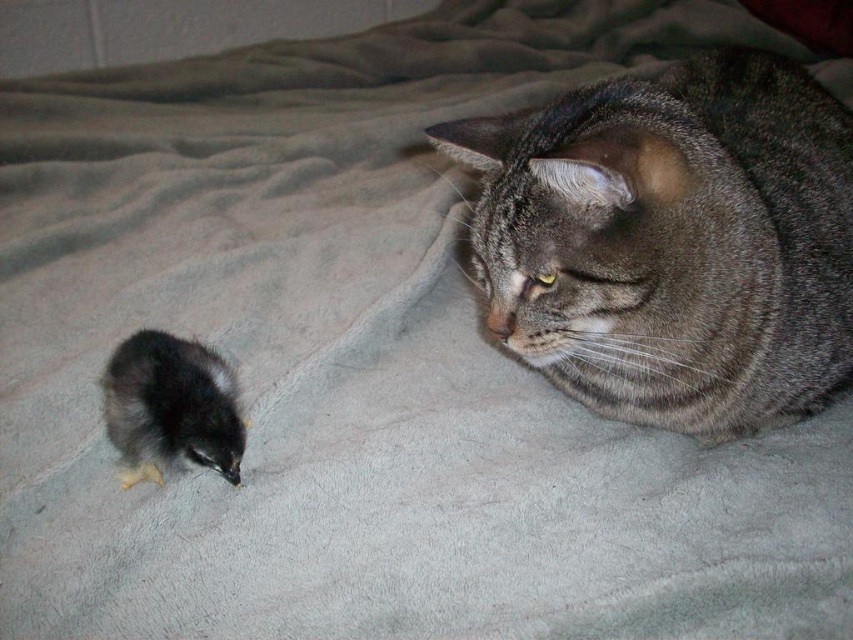
Can you confirm if gray tabby cat at upper right is taller than fluffy black bird at lower left?

Yes, gray tabby cat at upper right is taller than fluffy black bird at lower left.

Does gray tabby cat at upper right have a lesser width compared to fluffy black bird at lower left?

In fact, gray tabby cat at upper right might be wider than fluffy black bird at lower left.

Is point (485, 285) more distant than point (209, 358)?

No, (485, 285) is in front of (209, 358).

The image size is (853, 640). What are the coordinates of `gray tabby cat at upper right` in the screenshot? It's located at (672, 241).